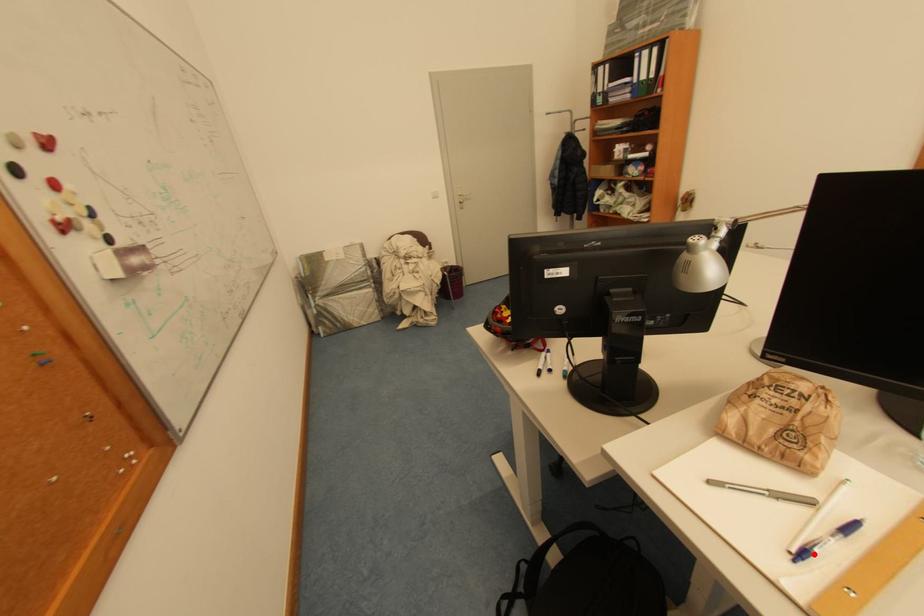
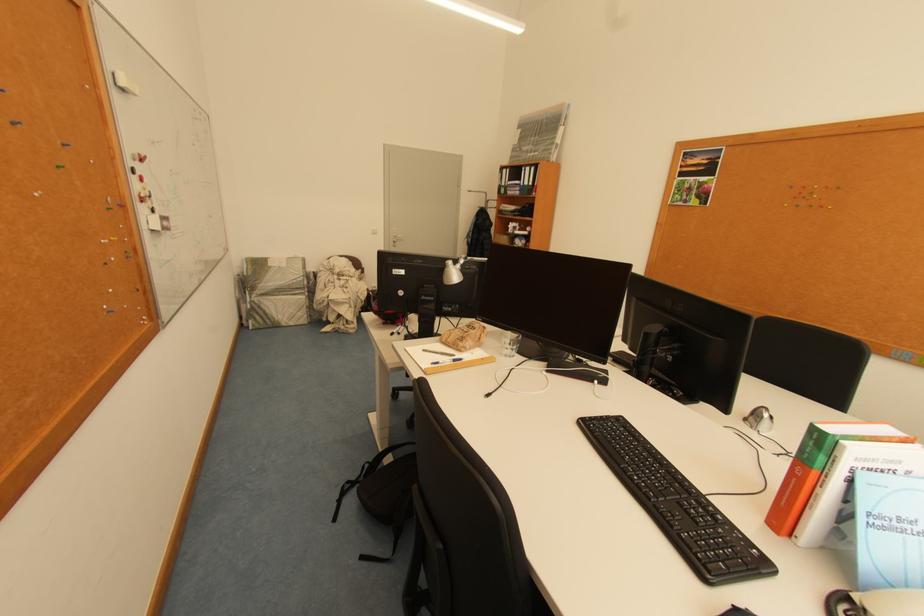
Locate, in the second image, the point that corresponds to the highlighted location in the first image.

(445, 363)